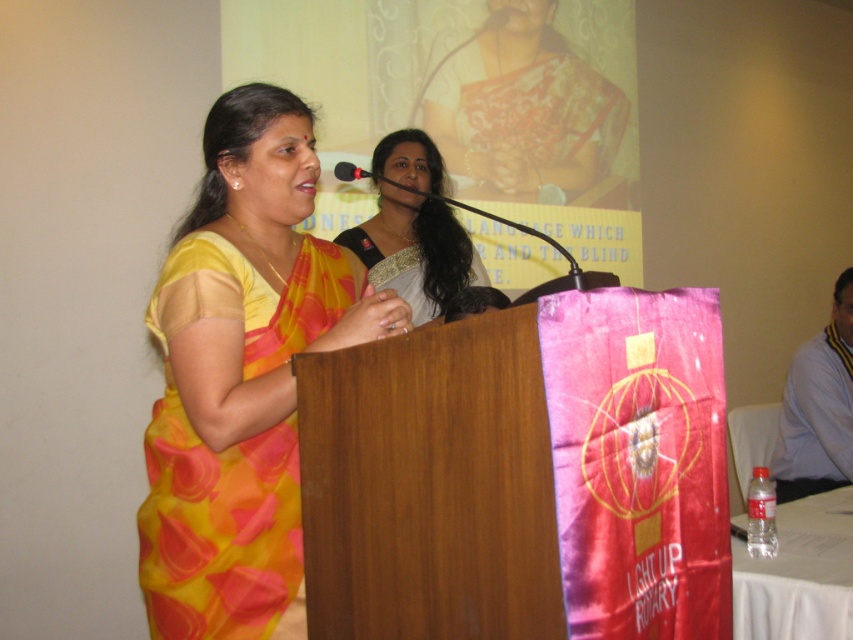
Who is positioned more to the left, yellow silk saree at center or black plastic microphone at center?

Positioned to the left is yellow silk saree at center.

Who is shorter, yellow silk saree at center or black plastic microphone at center?

Standing shorter between the two is black plastic microphone at center.

Does point (254, 474) come in front of point (358, 168)?

Yes, it is in front of point (358, 168).

Locate an element on the screen. Image resolution: width=853 pixels, height=640 pixels. yellow silk saree at center is located at coordinates (241, 372).

Which of these two, yellow silk saree at center or silky white saree at center, stands taller?

yellow silk saree at center

Image resolution: width=853 pixels, height=640 pixels. Find the location of `yellow silk saree at center`. yellow silk saree at center is located at coordinates (241, 372).

Identify the location of yellow silk saree at center. Image resolution: width=853 pixels, height=640 pixels. (241, 372).

Can you confirm if silky white saree at center is positioned below black plastic microphone at center?

Incorrect, silky white saree at center is not positioned below black plastic microphone at center.

In the scene shown: Does silky white saree at center have a greater height compared to black plastic microphone at center?

Yes, silky white saree at center is taller than black plastic microphone at center.

This screenshot has width=853, height=640. In order to click on silky white saree at center in this screenshot , I will do `click(415, 252)`.